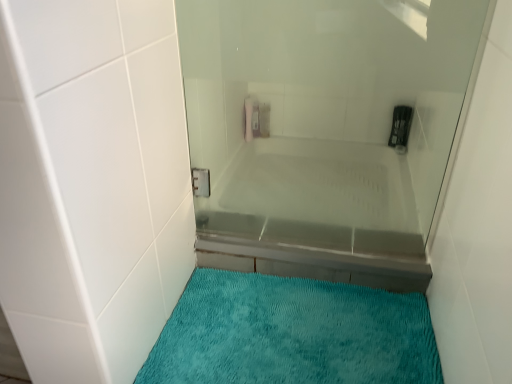
Question: From a real-world perspective, relative to clear glass bathtub at center, is transparent glass shower door at center vertically above or below?

Choices:
 (A) below
 (B) above

Answer: (B)

Question: Is transparent glass shower door at center spatially inside clear glass bathtub at center, or outside of it?

Choices:
 (A) outside
 (B) inside

Answer: (A)

Question: Which object is the closest to the transparent glass shower door at center?

Choices:
 (A) teal plush bath mat at lower center
 (B) clear glass bathtub at center

Answer: (B)

Question: Which object is positioned farthest from the teal plush bath mat at lower center?

Choices:
 (A) clear glass bathtub at center
 (B) transparent glass shower door at center

Answer: (B)